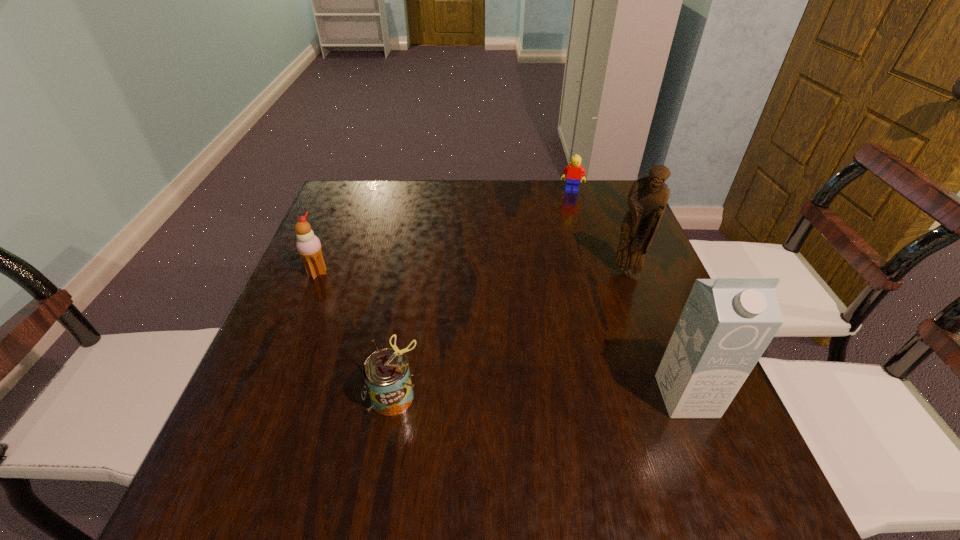
This screenshot has height=540, width=960. I want to click on the second object from left to right, so click(386, 374).

In order to click on can in this screenshot , I will do `click(386, 374)`.

This screenshot has height=540, width=960. What are the coordinates of `carton` in the screenshot? It's located at (727, 323).

Locate an element on the screen. This screenshot has width=960, height=540. figurine is located at coordinates (647, 199).

You are a GUI agent. You are given a task and a screenshot of the screen. Output one action in this format:
    pyautogui.click(x=<x>, y=<y>)
    Task: Click on the leftmost object
    
    Given the screenshot: What is the action you would take?
    tap(308, 245)

Identify the location of the farthest object. (572, 173).

Where is `Lego`? Image resolution: width=960 pixels, height=540 pixels. Lego is located at coordinates (572, 173).

The height and width of the screenshot is (540, 960). Find the location of `vacant position located 0.300m on the right of the can`. vacant position located 0.300m on the right of the can is located at coordinates (580, 395).

Where is `vacant space located 0.400m on the front-facing side of the figurine`? vacant space located 0.400m on the front-facing side of the figurine is located at coordinates (531, 392).

At what (x,y) coordinates should I click in order to perform the action: click on vacant area located 0.310m on the front-facing side of the figurine. Please return your answer as a coordinate pair (x, y). The width and height of the screenshot is (960, 540). Looking at the image, I should click on (555, 362).